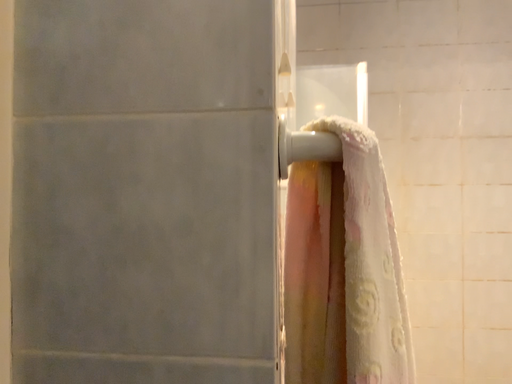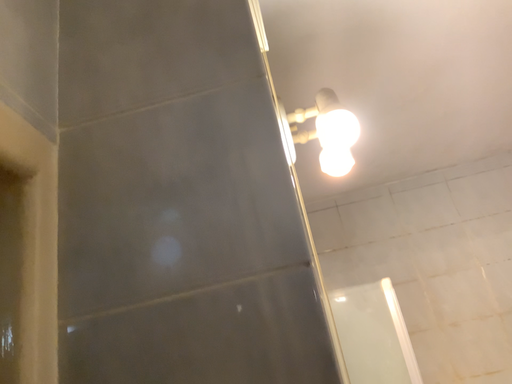
Question: Which way did the camera rotate in the video?

Choices:
 (A) rotated downward
 (B) rotated upward

Answer: (B)